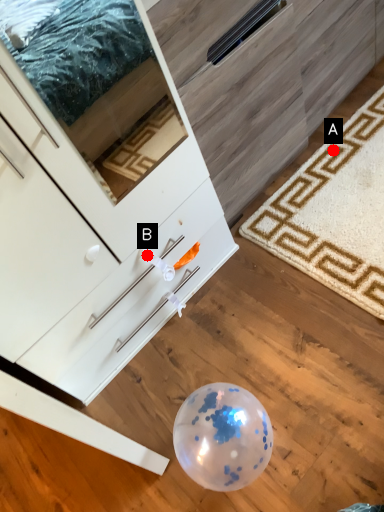
Question: Two points are circled on the image, labeled by A and B beside each circle. Among these points, which one is farthest from the camera?

Choices:
 (A) A is further
 (B) B is further

Answer: (A)